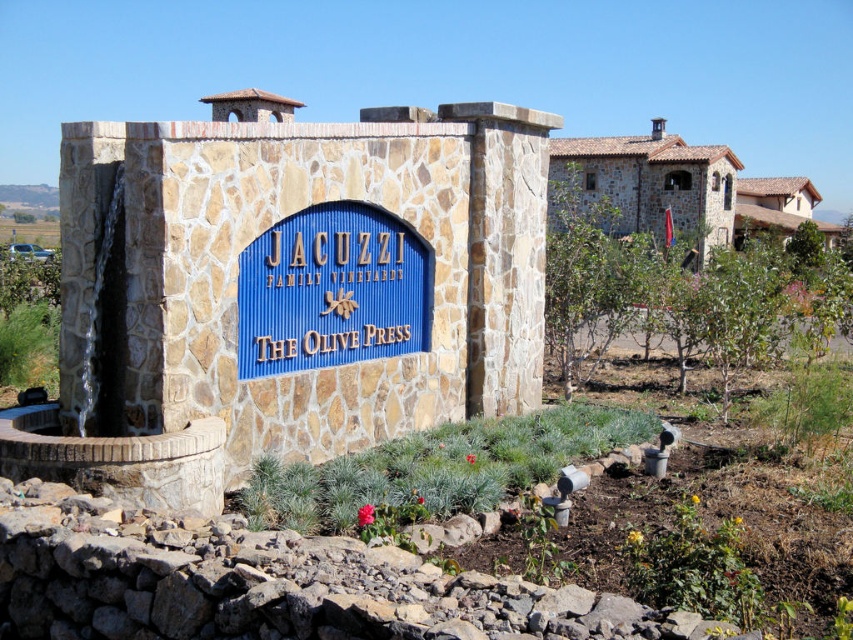
Is blue stone sign at center taller than green stone/rockery at lower center?

Yes.

Who is shorter, blue stone sign at center or green stone/rockery at lower center?

green stone/rockery at lower center is shorter.

Locate an element on the screen. blue stone sign at center is located at coordinates (331, 291).